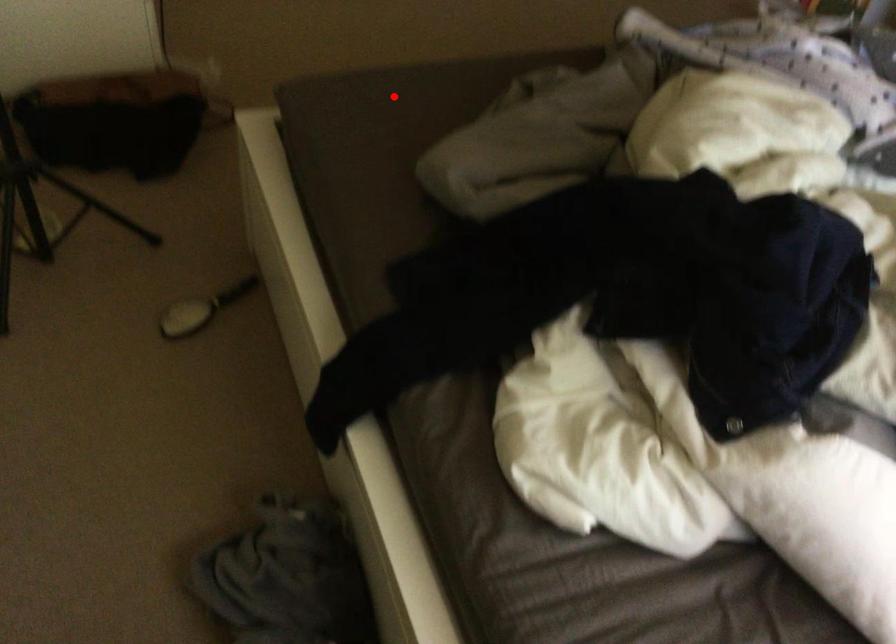
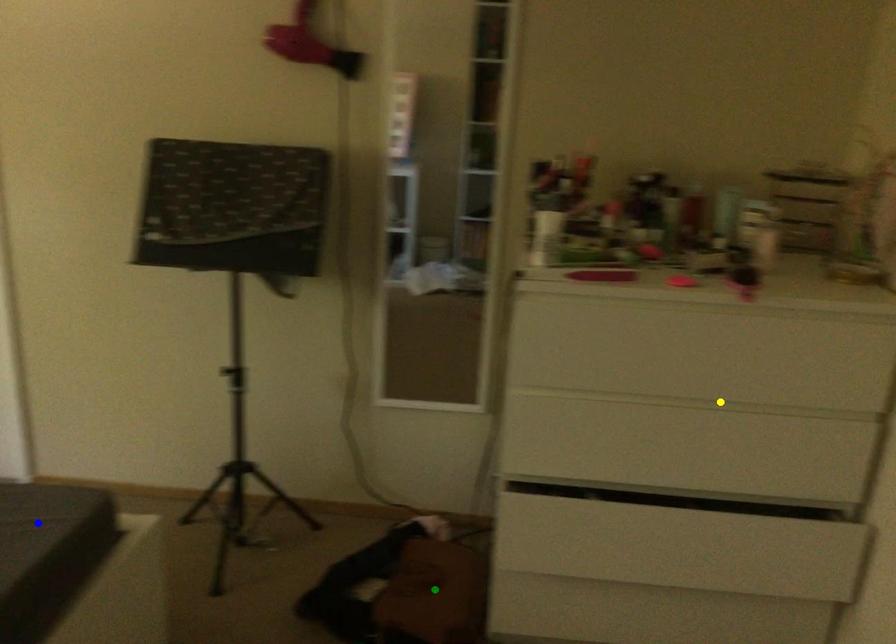
Question: I am providing you with two images of the same scene from different viewpoints. A red point is marked on the first image. You are given multiple points on the second image. Which point in image 2 is actually the same real-world point as the red point in image 1?

Choices:
 (A) yellow point
 (B) green point
 (C) blue point

Answer: (C)